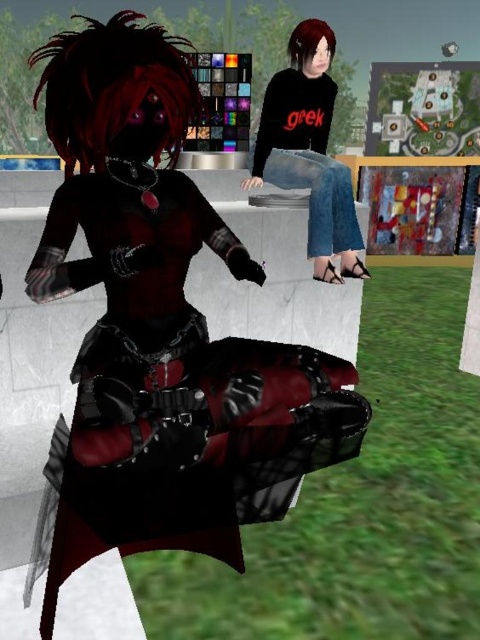
Question: Is matte black armor at center below denim jeans at center?

Choices:
 (A) yes
 (B) no

Answer: (A)

Question: Which of the following is the closest to the observer?

Choices:
 (A) (236, 342)
 (B) (299, 100)

Answer: (A)

Question: Which object is farther from the camera taking this photo?

Choices:
 (A) matte black armor at center
 (B) denim jeans at center

Answer: (B)

Question: Is matte black armor at center wider than denim jeans at center?

Choices:
 (A) yes
 (B) no

Answer: (A)

Question: Is matte black armor at center below denim jeans at center?

Choices:
 (A) no
 (B) yes

Answer: (B)